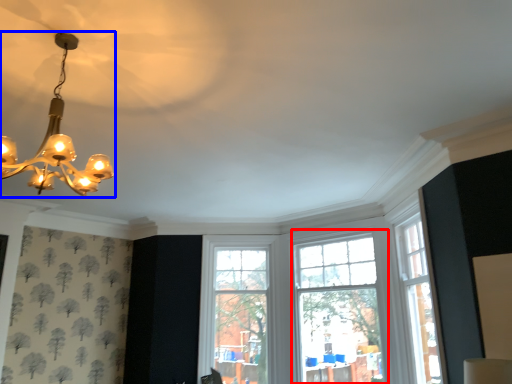
Question: Which of the following is the closest to the observer, window (highlighted by a red box) or lamp (highlighted by a blue box)?

Choices:
 (A) window
 (B) lamp

Answer: (B)